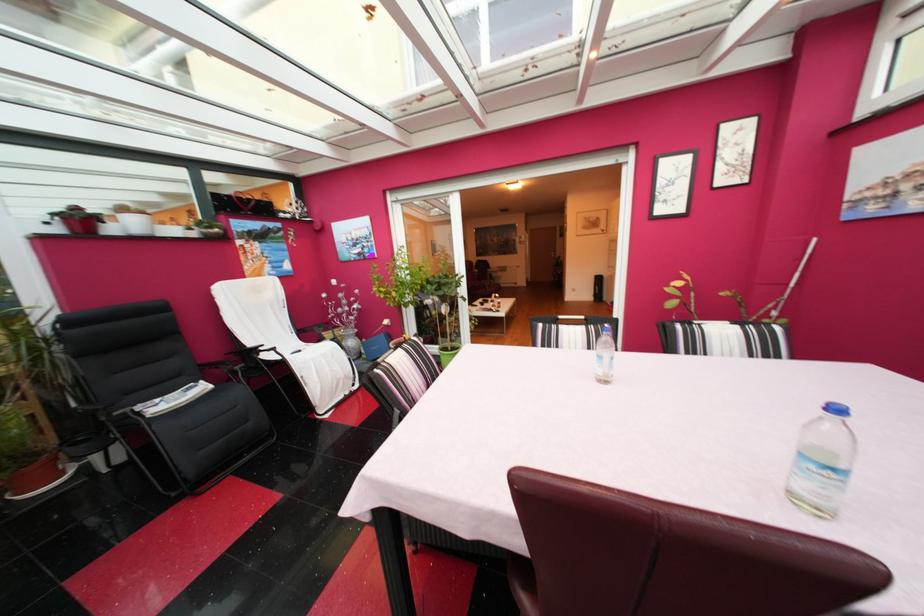
The image size is (924, 616). I want to click on silver decorative vase, so click(x=350, y=342).